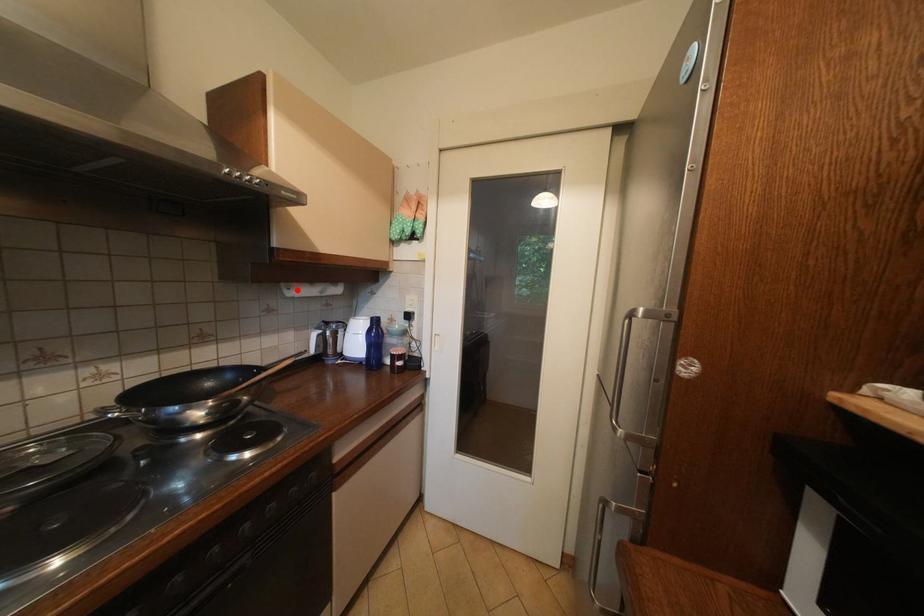
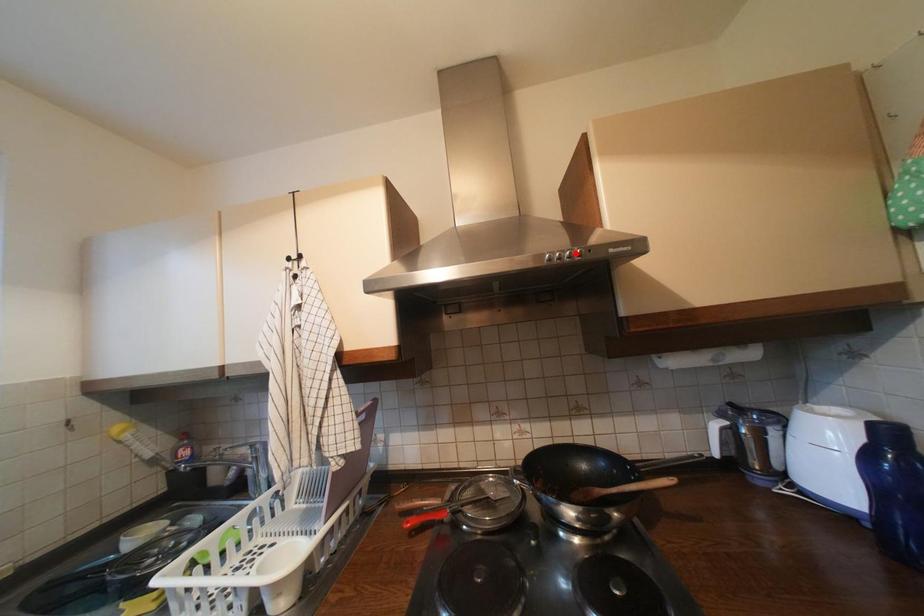
In the scene shown: I am providing you with two images of the same scene from different viewpoints. A red point is marked on the first image and another point is marked on the second image. Is the marked point in image1 the same physical position as the marked point in image2?

No